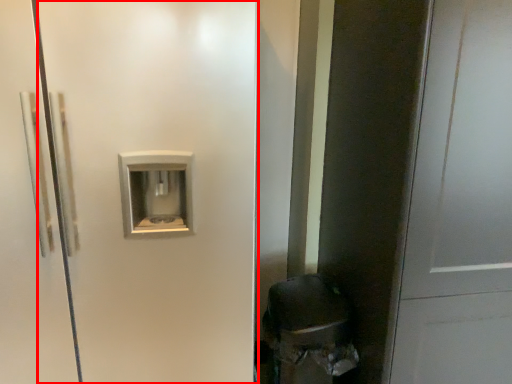
Question: From the image's perspective, what is the correct spatial positioning of screen door (annotated by the red box) in reference to door?

Choices:
 (A) above
 (B) below

Answer: (A)